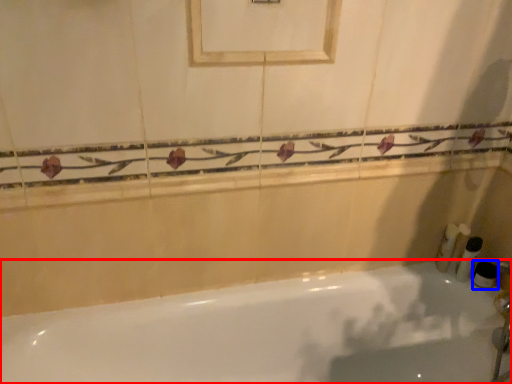
Question: Which object is closer to the camera taking this photo, bathtub (highlighted by a red box) or toiletry (highlighted by a blue box)?

Choices:
 (A) bathtub
 (B) toiletry

Answer: (A)